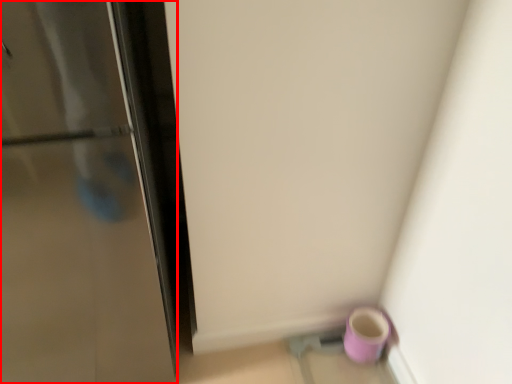
Question: Considering the relative positions of door (annotated by the red box) and mug in the image provided, where is door (annotated by the red box) located with respect to the staircase?

Choices:
 (A) left
 (B) right

Answer: (A)